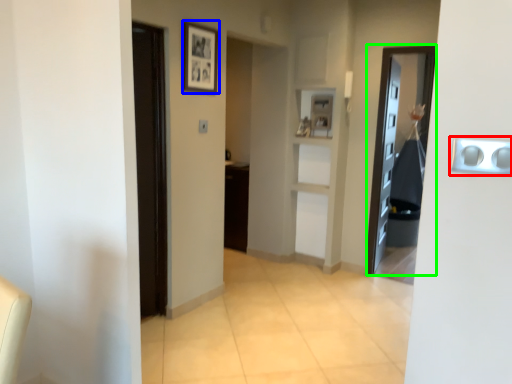
Question: Which object is the farthest from door handle (highlighted by a red box)? Choose among these: picture frame (highlighted by a blue box) or door (highlighted by a green box).

Choices:
 (A) picture frame
 (B) door

Answer: (B)